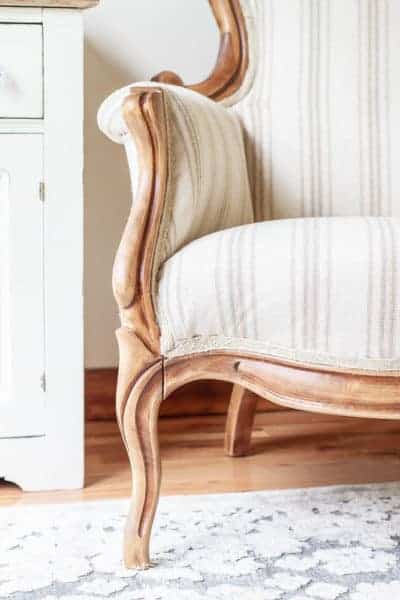
Where is `chair legs`? This screenshot has height=600, width=400. chair legs is located at coordinates (144, 469), (237, 421).